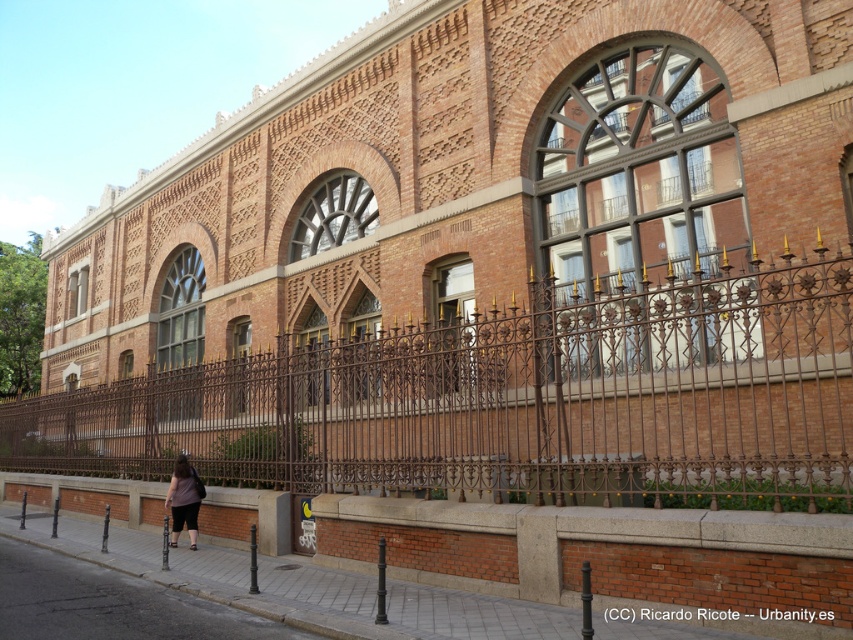
Is brown wrought iron fence at center taller than gray concrete pavement at lower center?

Indeed, brown wrought iron fence at center has a greater height compared to gray concrete pavement at lower center.

Is brown wrought iron fence at center below gray concrete pavement at lower center?

Incorrect, brown wrought iron fence at center is not positioned below gray concrete pavement at lower center.

Does point (383, 417) come farther from viewer compared to point (595, 596)?

Yes, point (383, 417) is behind point (595, 596).

Identify the location of brown wrought iron fence at center. The image size is (853, 640). (508, 404).

Who is higher up, gray concrete pavement at lower center or gray concrete sidewalk at lower left?

gray concrete sidewalk at lower left is above.

Is gray concrete pavement at lower center shorter than gray concrete sidewalk at lower left?

Incorrect, gray concrete pavement at lower center's height does not fall short of gray concrete sidewalk at lower left's.

I want to click on gray concrete pavement at lower center, so click(x=314, y=586).

Can you confirm if brown wrought iron fence at center is thinner than dark brown fabric pants at lower left?

In fact, brown wrought iron fence at center might be wider than dark brown fabric pants at lower left.

Is point (287, 458) behind point (190, 472)?

No, (287, 458) is closer to viewer.

Describe the element at coordinates (508, 404) in the screenshot. Image resolution: width=853 pixels, height=640 pixels. I see `brown wrought iron fence at center` at that location.

Where is `brown wrought iron fence at center`? The width and height of the screenshot is (853, 640). brown wrought iron fence at center is located at coordinates (508, 404).